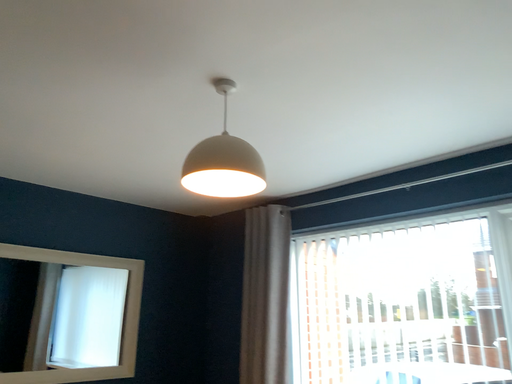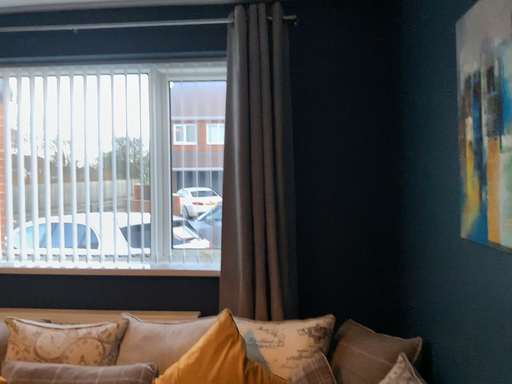
Question: How did the camera likely rotate when shooting the video?

Choices:
 (A) rotated left
 (B) rotated right

Answer: (B)